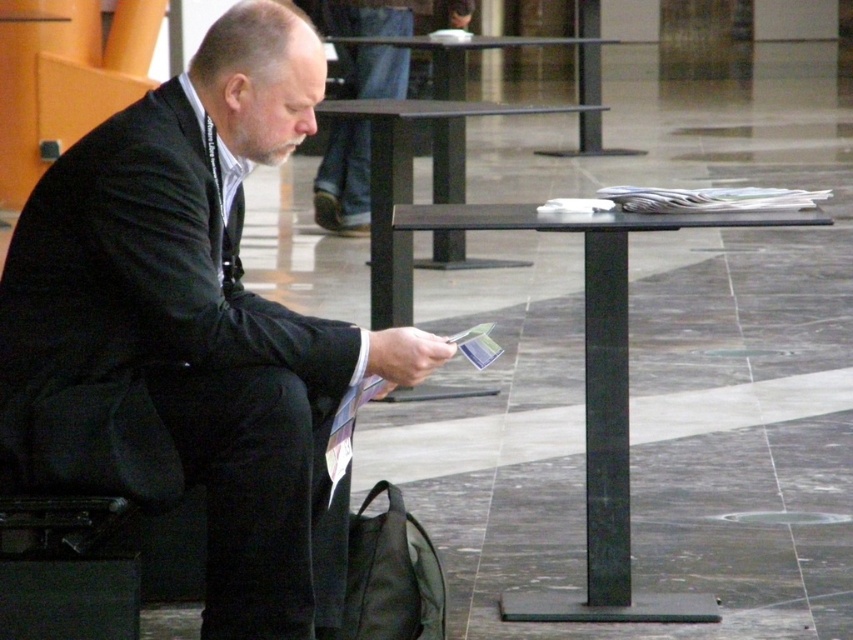
Does point (265, 304) come closer to viewer compared to point (624, 579)?

Yes, point (265, 304) is in front of point (624, 579).

Is point (268, 26) closer to viewer compared to point (601, 381)?

Yes, it is.

The image size is (853, 640). Identify the location of matte black suit at center. (206, 314).

Based on the photo, who is positioned more to the left, black metal table at center or black glass table at center?

Positioned to the left is black glass table at center.

Can you confirm if black metal table at center is taller than black glass table at center?

Yes.

Measure the distance between point (457,209) and camera.

Point (457,209) and camera are 4.23 meters apart.

The height and width of the screenshot is (640, 853). In order to click on black metal table at center in this screenshot , I will do `click(598, 396)`.

Does point (379, 125) come closer to viewer compared to point (380, 586)?

That is False.

Is point (450, 234) in front of point (428, 573)?

That is False.

Where is `black glass table at center`? This screenshot has width=853, height=640. black glass table at center is located at coordinates (412, 188).